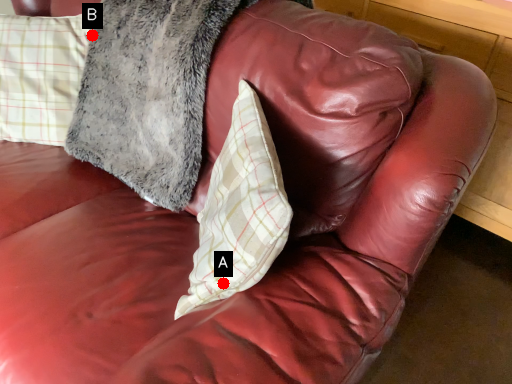
Question: Two points are circled on the image, labeled by A and B beside each circle. Which point is farther to the camera?

Choices:
 (A) A is further
 (B) B is further

Answer: (B)